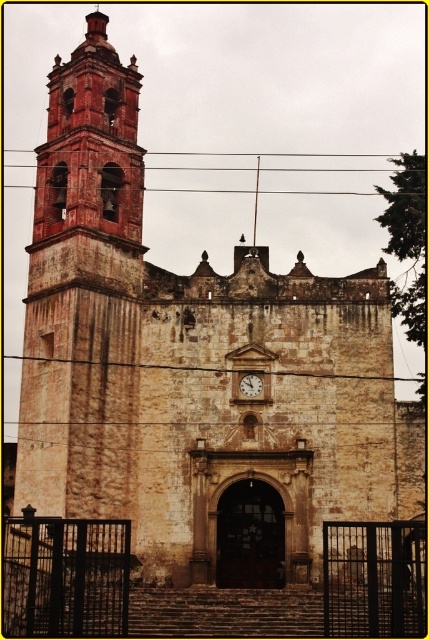
Which is more to the right, brown wire at upper center or wooden clock at center?

From the viewer's perspective, wooden clock at center appears more on the right side.

Who is lower down, brown wire at upper center or wooden clock at center?

wooden clock at center is below.

What are the coordinates of `brown wire at upper center` in the screenshot? It's located at (329, 170).

Between brown stone clock at center and wooden clock at center, which one is positioned lower?

wooden clock at center

Measure the distance between point (195, 371) and camera.

73.11 meters

Identify the location of brown stone clock at center. (123, 364).

From the picture: Is red brick bell tower at left to the left of brown wire at upper center from the viewer's perspective?

Correct, you'll find red brick bell tower at left to the left of brown wire at upper center.

Is red brick bell tower at left positioned in front of brown wire at upper center?

Yes, red brick bell tower at left is in front of brown wire at upper center.

Does point (93, 200) come behind point (311, 170)?

No, it is not.

Identify the location of red brick bell tower at left. (90, 141).